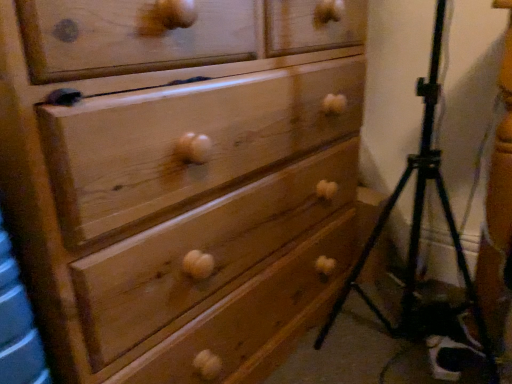
Question: Considering the relative sizes of black metal tripod at lower right and wooden chest of drawers at center in the image provided, is black metal tripod at lower right taller than wooden chest of drawers at center?

Choices:
 (A) no
 (B) yes

Answer: (A)

Question: Is black metal tripod at lower right closer to camera compared to wooden chest of drawers at center?

Choices:
 (A) yes
 (B) no

Answer: (B)

Question: Does black metal tripod at lower right appear on the left side of wooden chest of drawers at center?

Choices:
 (A) yes
 (B) no

Answer: (B)

Question: Is black metal tripod at lower right thinner than wooden chest of drawers at center?

Choices:
 (A) yes
 (B) no

Answer: (A)

Question: Are black metal tripod at lower right and wooden chest of drawers at center making contact?

Choices:
 (A) no
 (B) yes

Answer: (A)

Question: Is wooden chest of drawers at center a part of black metal tripod at lower right?

Choices:
 (A) no
 (B) yes

Answer: (A)

Question: Considering the relative sizes of wooden chest of drawers at center and black metal tripod at lower right in the image provided, is wooden chest of drawers at center shorter than black metal tripod at lower right?

Choices:
 (A) yes
 (B) no

Answer: (B)

Question: Are wooden chest of drawers at center and black metal tripod at lower right beside each other?

Choices:
 (A) yes
 (B) no

Answer: (B)

Question: Does wooden chest of drawers at center contain black metal tripod at lower right?

Choices:
 (A) no
 (B) yes

Answer: (A)

Question: Considering the relative positions of wooden chest of drawers at center and black metal tripod at lower right in the image provided, is wooden chest of drawers at center to the left of black metal tripod at lower right from the viewer's perspective?

Choices:
 (A) yes
 (B) no

Answer: (A)

Question: Does wooden chest of drawers at center have a smaller size compared to black metal tripod at lower right?

Choices:
 (A) yes
 (B) no

Answer: (B)

Question: Does wooden chest of drawers at center lie behind black metal tripod at lower right?

Choices:
 (A) no
 (B) yes

Answer: (A)

Question: Considering the positions of wooden chest of drawers at center and black metal tripod at lower right in the image, is wooden chest of drawers at center bigger or smaller than black metal tripod at lower right?

Choices:
 (A) small
 (B) big

Answer: (B)